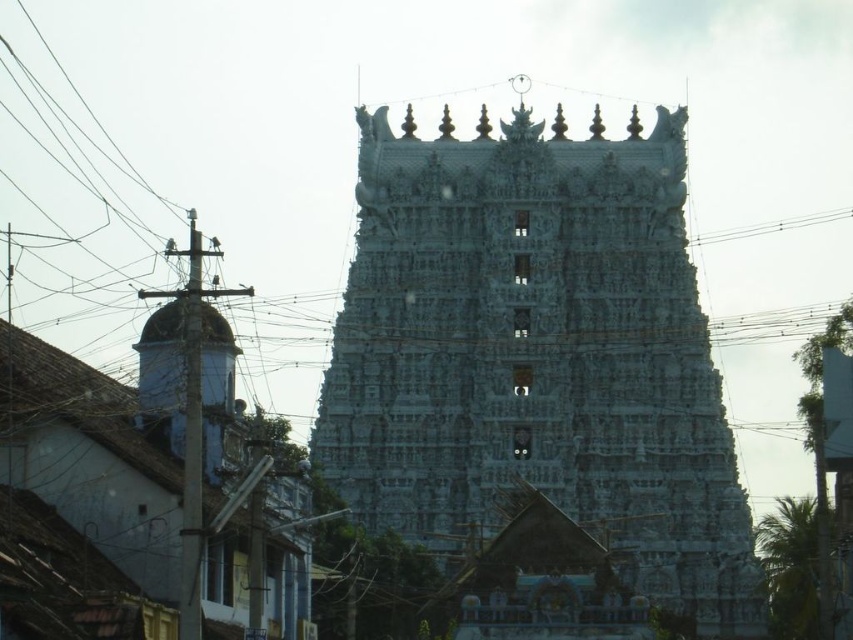
Question: Considering the relative positions of white stone temple at center and black wire at upper center in the image provided, where is white stone temple at center located with respect to black wire at upper center?

Choices:
 (A) left
 (B) right

Answer: (A)

Question: Which of the following is the farthest from the observer?

Choices:
 (A) (790, 221)
 (B) (708, 492)

Answer: (A)

Question: Is white stone temple at center behind black wire at upper center?

Choices:
 (A) no
 (B) yes

Answer: (A)

Question: Is white stone temple at center in front of black wire at upper center?

Choices:
 (A) yes
 (B) no

Answer: (A)